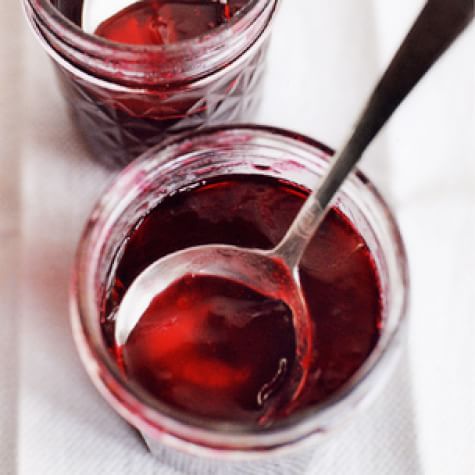
This screenshot has height=475, width=475. Find the location of `1 handle`. 1 handle is located at coordinates (406, 70).